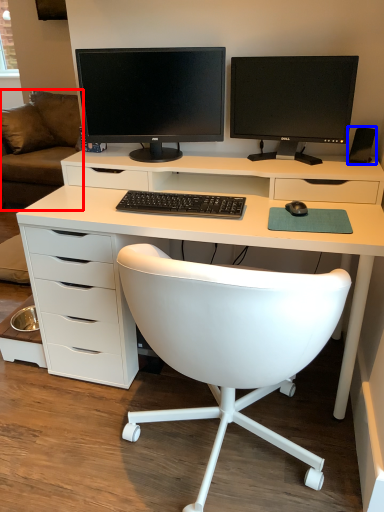
Question: Which point is closer to the camera, couch (highlighted by a red box) or speaker (highlighted by a blue box)?

Choices:
 (A) couch
 (B) speaker

Answer: (B)